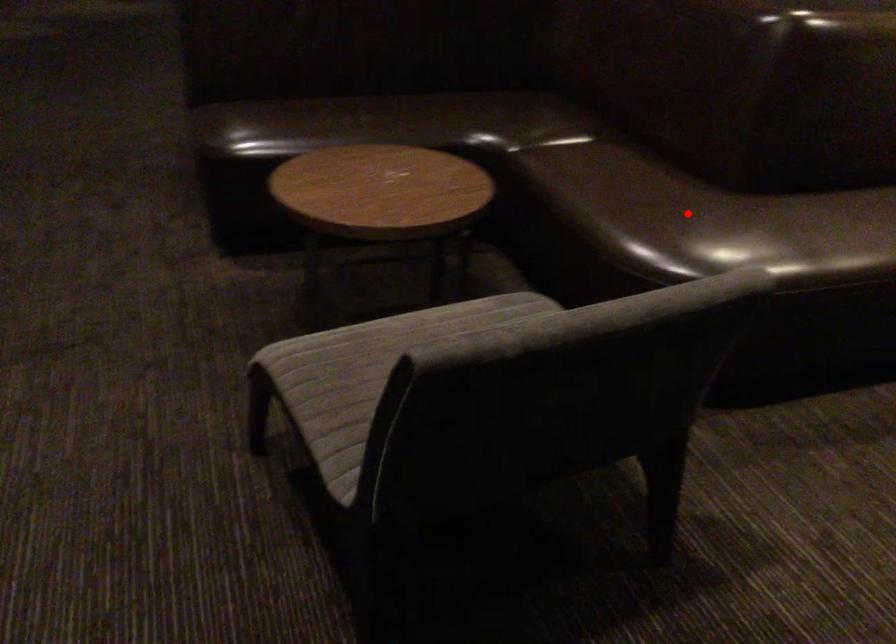
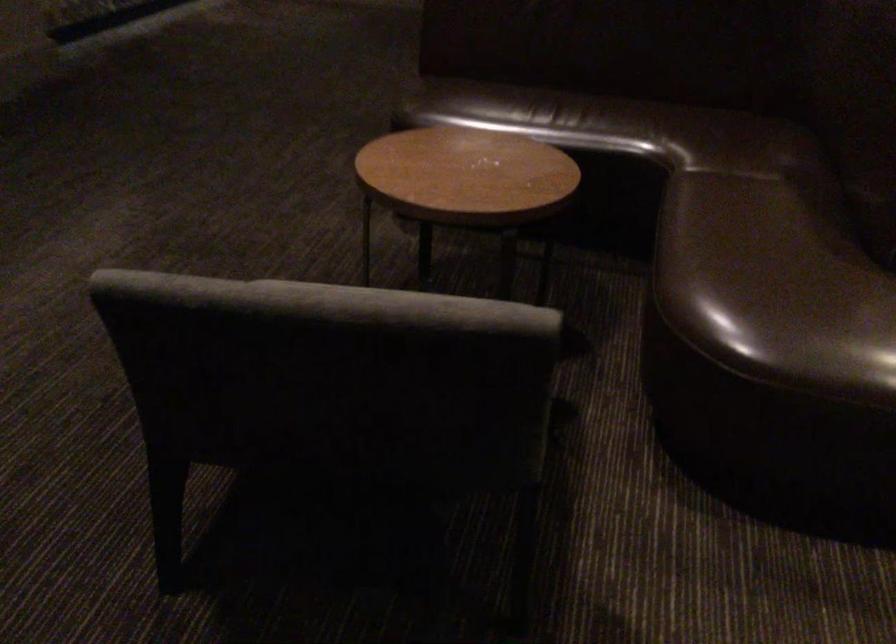
Where in the second image is the point corresponding to the highlighted location from the first image?

(772, 276)